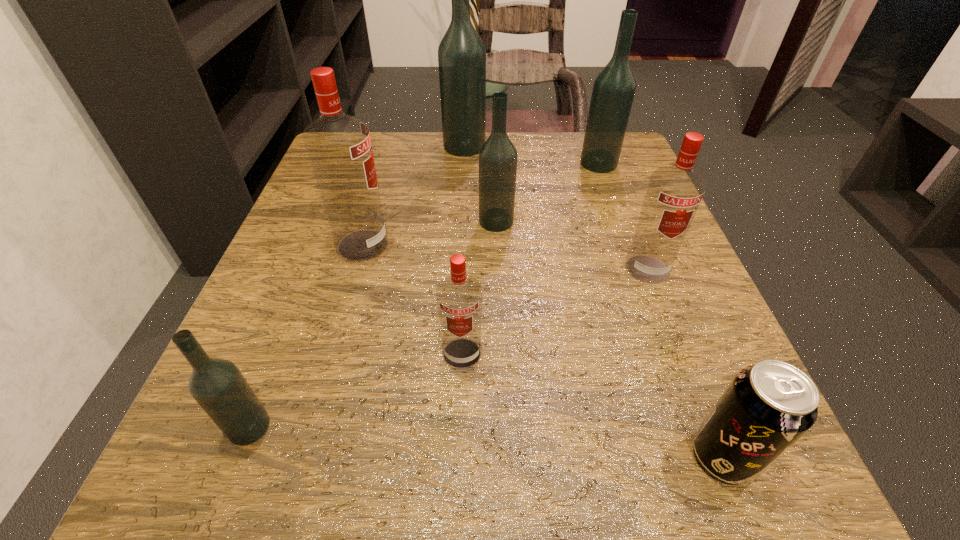
At what (x,y) coordinates should I click in order to perform the action: click on vacant area at the far left corner of the desktop. Please return your answer as a coordinate pair (x, y). Looking at the image, I should click on (373, 134).

Where is `vacant region at the near left corner of the desktop`? Image resolution: width=960 pixels, height=540 pixels. vacant region at the near left corner of the desktop is located at coordinates (203, 452).

In the image, there is a desktop. Identify the location of free space at the far right corner. (566, 140).

The height and width of the screenshot is (540, 960). I want to click on vacant space that's between the nearest red vodka and the smallest black vodka, so click(x=355, y=390).

Identify the location of vacant region between the third biggest black vodka and the seventh object from right to left. This screenshot has height=540, width=960. (429, 233).

Find the location of a particular element. The width and height of the screenshot is (960, 540). vacant region between the nearest vodka and the biggest black vodka is located at coordinates (357, 287).

This screenshot has height=540, width=960. What are the coordinates of `free space between the nearest vodka and the rightmost black vodka` in the screenshot? It's located at (424, 295).

This screenshot has height=540, width=960. What are the coordinates of `free space between the tallest object and the rightmost red vodka` in the screenshot? It's located at (556, 207).

Where is `unoccupied area between the third smallest black vodka and the shortest object`? This screenshot has width=960, height=540. unoccupied area between the third smallest black vodka and the shortest object is located at coordinates (661, 309).

The width and height of the screenshot is (960, 540). In order to click on free spot between the rightmost black vodka and the rightmost red vodka in this screenshot , I will do `click(623, 216)`.